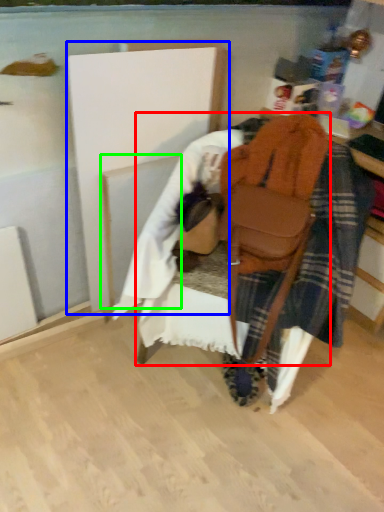
Question: Considering the real-world distances, which object is farthest from furniture (highlighted by a red box)? wood (highlighted by a blue box) or wood (highlighted by a green box)?

Choices:
 (A) wood
 (B) wood

Answer: (B)